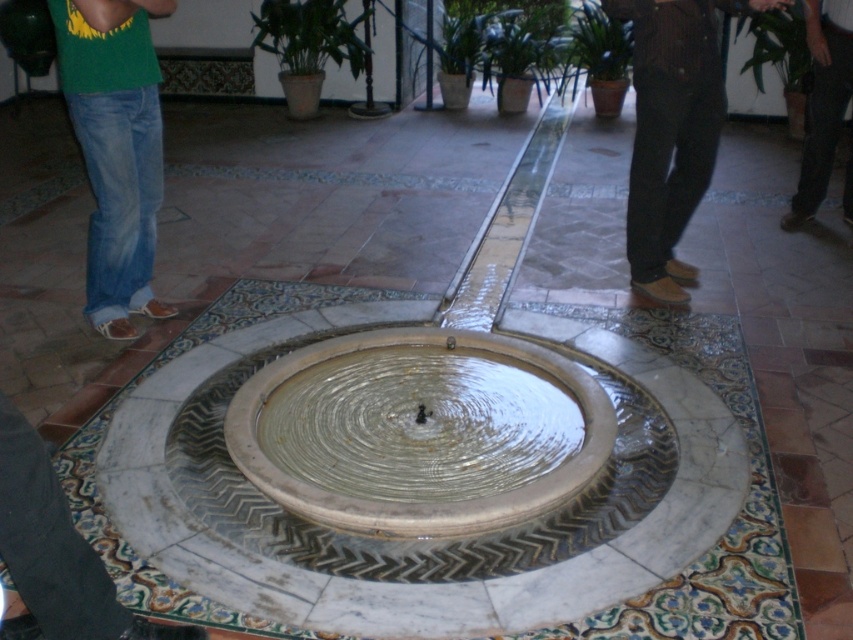
Question: Among these points, which one is farthest from the camera?

Choices:
 (A) (674, 97)
 (B) (849, 26)
 (C) (376, 524)

Answer: (B)

Question: Which point is closer to the camera?

Choices:
 (A) brown suede shoes at lower right
 (B) clear glass water at center

Answer: (B)

Question: Based on their relative distances, which object is farther from the clear glass water at center?

Choices:
 (A) dark brown leather shoes at lower right
 (B) brown suede shoes at lower right

Answer: (A)

Question: Can you confirm if clear glass water at center is wider than brown suede shoes at lower right?

Choices:
 (A) no
 (B) yes

Answer: (B)

Question: Does clear glass water at center have a larger size compared to denim jeans at left?

Choices:
 (A) no
 (B) yes

Answer: (B)

Question: Is clear glass water at center thinner than brown suede shoes at lower right?

Choices:
 (A) no
 (B) yes

Answer: (A)